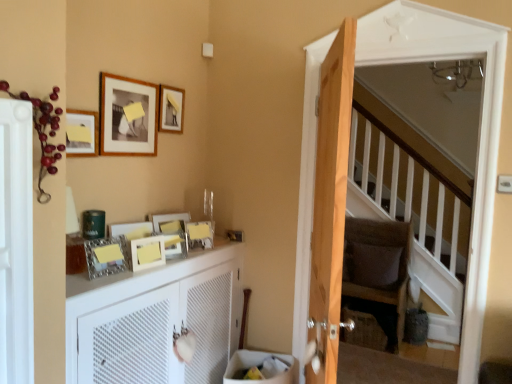
Question: Does matte wooden picture frame at upper left, positioned as the 6th picture frame in bottom-to-top order, touch matte silver picture frame at center, the 2th picture frame in the bottom-to-top sequence?

Choices:
 (A) no
 (B) yes

Answer: (A)

Question: Is matte wooden picture frame at upper left, positioned as the 6th picture frame in bottom-to-top order, not close to matte silver picture frame at center, the 2th picture frame in the bottom-to-top sequence?

Choices:
 (A) no
 (B) yes

Answer: (A)

Question: Considering the relative sizes of matte wooden picture frame at upper left, which is the third picture frame in top-to-bottom order, and matte silver picture frame at center, which ranks as the seventh picture frame in top-to-bottom order, in the image provided, is matte wooden picture frame at upper left, which is the third picture frame in top-to-bottom order, bigger than matte silver picture frame at center, which ranks as the seventh picture frame in top-to-bottom order,?

Choices:
 (A) yes
 (B) no

Answer: (B)

Question: Is matte wooden picture frame at upper left, which is the third picture frame in top-to-bottom order, facing towards matte silver picture frame at center, the 2th picture frame in the bottom-to-top sequence?

Choices:
 (A) yes
 (B) no

Answer: (B)

Question: From a real-world perspective, is matte wooden picture frame at upper left, which is the third picture frame in top-to-bottom order, below matte silver picture frame at center, the 2th picture frame in the bottom-to-top sequence?

Choices:
 (A) no
 (B) yes

Answer: (A)

Question: From a real-world perspective, is matte wooden picture frame at upper left, which is the third picture frame in top-to-bottom order, over matte silver picture frame at center, which ranks as the seventh picture frame in top-to-bottom order?

Choices:
 (A) no
 (B) yes

Answer: (B)

Question: Is the depth of matte wooden picture frame at upper center, the 4th picture frame positioned from the top, greater than that of wooden screen door at right, which is the first screen door from right to left?

Choices:
 (A) no
 (B) yes

Answer: (B)

Question: Considering the relative positions of matte wooden picture frame at upper center, the 4th picture frame positioned from the top, and wooden screen door at right, placed as the first screen door when sorted from back to front, in the image provided, is matte wooden picture frame at upper center, the 4th picture frame positioned from the top, to the right of wooden screen door at right, placed as the first screen door when sorted from back to front, from the viewer's perspective?

Choices:
 (A) no
 (B) yes

Answer: (A)

Question: Is matte wooden picture frame at upper center, acting as the fifth picture frame starting from the bottom, wider than wooden screen door at right, the 2th screen door from the left?

Choices:
 (A) yes
 (B) no

Answer: (B)

Question: Can you confirm if matte wooden picture frame at upper center, the 4th picture frame positioned from the top, is shorter than wooden screen door at right, the 2th screen door from the left?

Choices:
 (A) no
 (B) yes

Answer: (B)

Question: Can you confirm if matte wooden picture frame at upper center, the 4th picture frame positioned from the top, is positioned to the left of wooden screen door at right, placed as the first screen door when sorted from back to front?

Choices:
 (A) no
 (B) yes

Answer: (B)

Question: From the image's perspective, is dark brown fabric armchair at center above matte silver picture frame at center, the 2th picture frame in the bottom-to-top sequence?

Choices:
 (A) yes
 (B) no

Answer: (B)